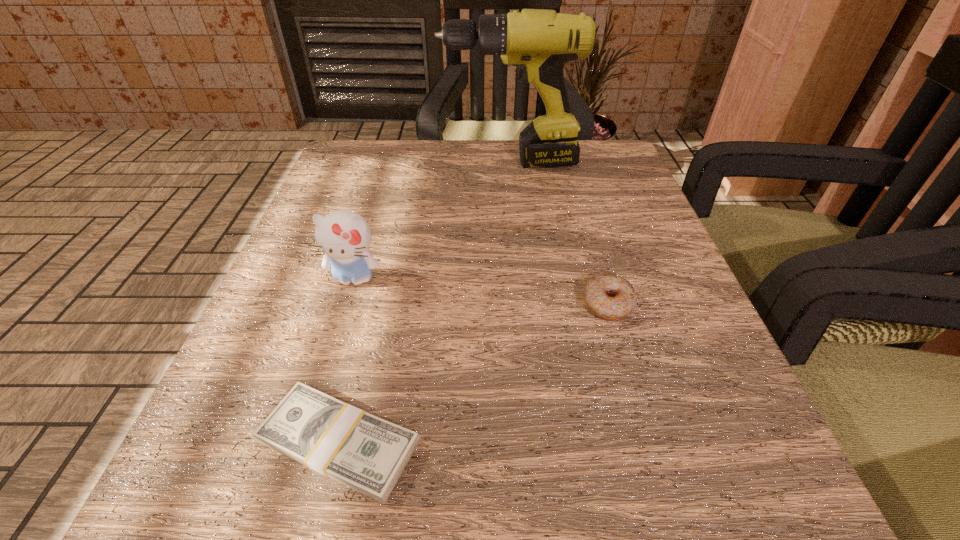
This screenshot has width=960, height=540. What are the coordinates of `empty space between the shortest object and the farthest object` in the screenshot? It's located at (424, 302).

Identify the location of vacant region between the kitten and the shortest object. The height and width of the screenshot is (540, 960). (347, 361).

Where is `blank region between the third shortest object and the second shortest object`? blank region between the third shortest object and the second shortest object is located at coordinates (480, 291).

In order to click on vacant space in between the doughnut and the dollar in this screenshot , I will do `click(473, 373)`.

The width and height of the screenshot is (960, 540). Identify the location of free space between the farthest object and the doughnut. [559, 233].

Identify the location of vacant area between the farthest object and the shortest object. This screenshot has width=960, height=540. (424, 302).

Locate an element on the screen. object that stands as the closest to the dollar is located at coordinates (344, 236).

Identify which object is the third nearest to the shortest object. Please provide its 2D coordinates. Your answer should be formatted as a tuple, i.e. [(x, y)], where the tuple contains the x and y coordinates of a point satisfying the conditions above.

[(539, 42)]

Locate an element on the screen. vacant point that satisfies the following two spatial constraints: 1. on the handle side of the tallest object; 2. on the front-facing side of the kitten is located at coordinates [521, 279].

The width and height of the screenshot is (960, 540). I want to click on vacant area that satisfies the following two spatial constraints: 1. on the handle side of the doughnut; 2. on the right side of the drill, so click(523, 303).